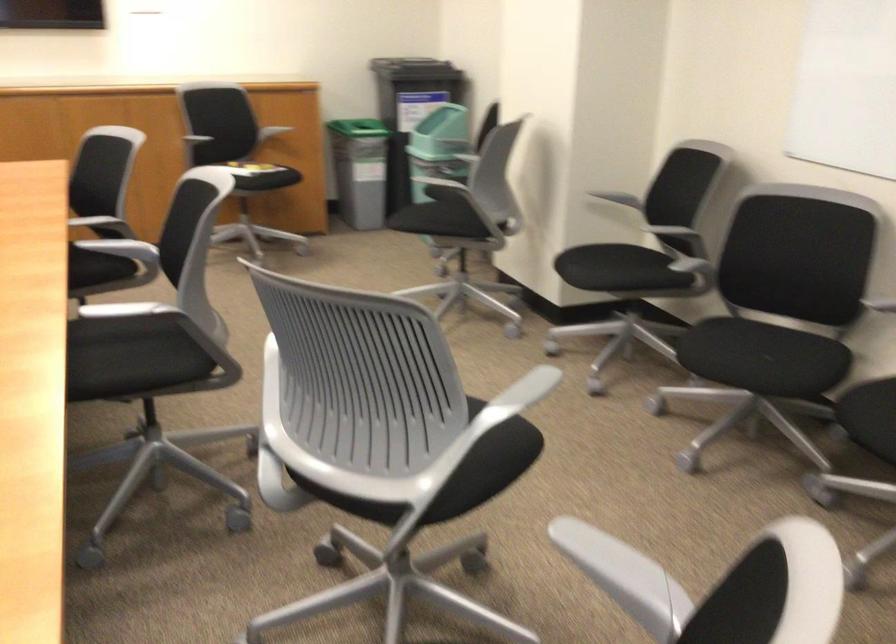
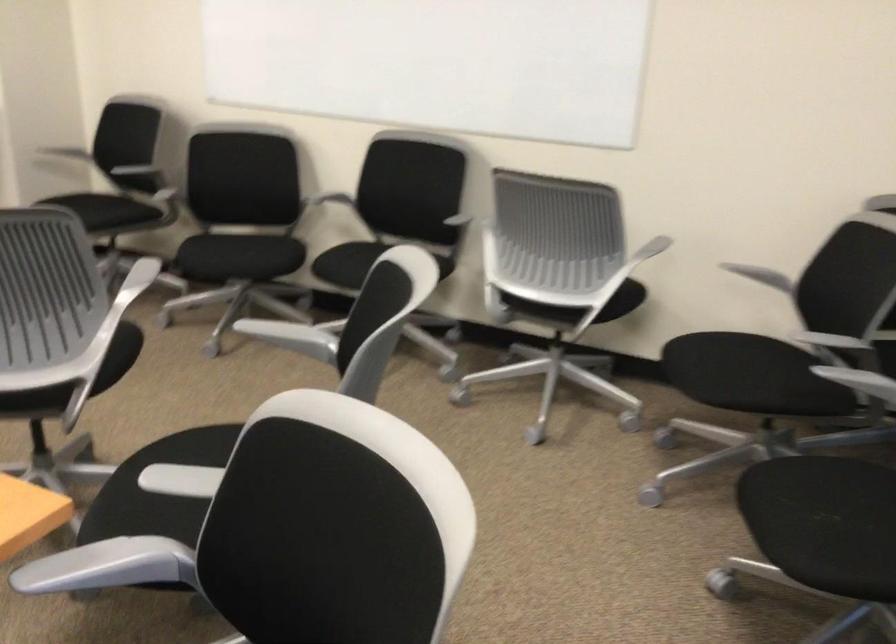
The point at (x=673, y=239) is marked in the first image. Where is the corresponding point in the second image?

(152, 180)